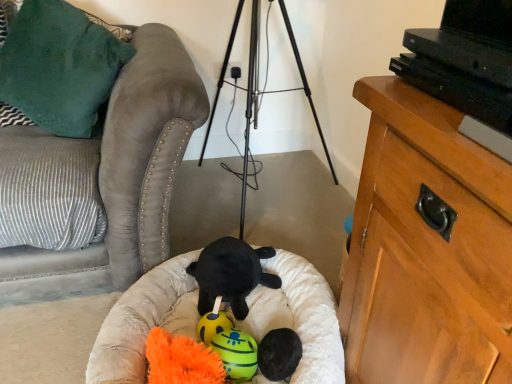
Question: Considering the positions of white plush dog bed at center and wooden cabinet at right in the image, is white plush dog bed at center taller or shorter than wooden cabinet at right?

Choices:
 (A) short
 (B) tall

Answer: (A)

Question: Is white plush dog bed at center in front of or behind wooden cabinet at right in the image?

Choices:
 (A) front
 (B) behind

Answer: (B)

Question: Considering the real-world distances, which object is farthest from the soft plush ball at center, acting as the 4th toy starting from the back?

Choices:
 (A) wooden cabinet at right
 (B) velvety green pillow at upper left
 (C) white plush dog bed at center
 (D) yellow rubber ball at center, which appears as the 4th toy when viewed from the front
 (E) yellow rubber ball at center, positioned as the third toy in back-to-front order

Answer: (B)

Question: Which object is the farthest from the wooden cabinet at right?

Choices:
 (A) white plush dog bed at center
 (B) velvety green pillow at upper left
 (C) black plush toy at center, placed as the 3th toy when sorted from front to back
 (D) yellow rubber ball at center, which appears as the 4th toy when viewed from the front
 (E) suede couch at left

Answer: (B)